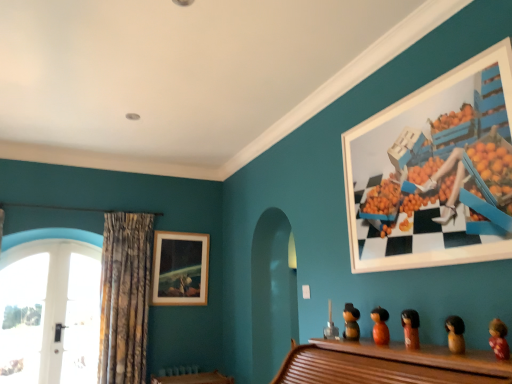
Where is `free space above white matte picture frame at upper right, acting as the 2th picture frame starting from the back (from a real-world perspective)`? This screenshot has height=384, width=512. free space above white matte picture frame at upper right, acting as the 2th picture frame starting from the back (from a real-world perspective) is located at coordinates (412, 91).